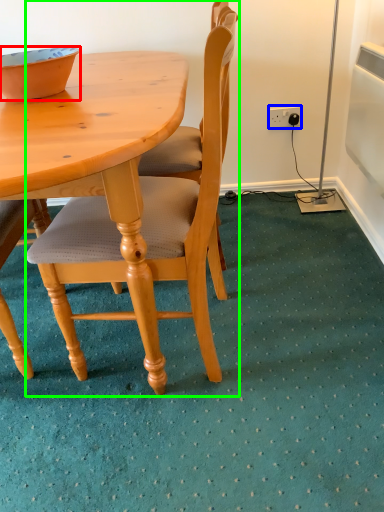
Question: Which object is the closest to the bowl (highlighted by a red box)? Choose among these: power outlet (highlighted by a blue box) or chair (highlighted by a green box).

Choices:
 (A) power outlet
 (B) chair

Answer: (B)